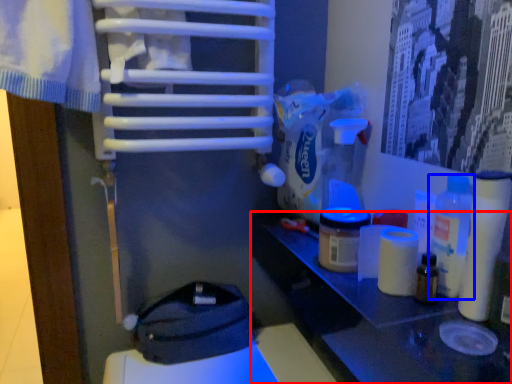
Question: Which of the following is the farthest to the observer, table (highlighted by a red box) or bottle (highlighted by a blue box)?

Choices:
 (A) table
 (B) bottle

Answer: (B)